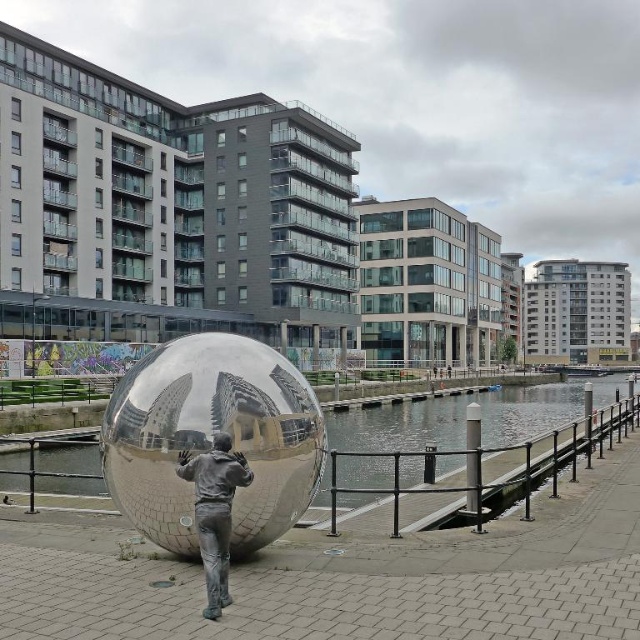
Question: Which point is closer to the camera?

Choices:
 (A) glossy metallic water at center
 (B) silver reflective statue at center

Answer: (B)

Question: Is glossy metallic water at center wider than silver reflective statue at center?

Choices:
 (A) no
 (B) yes

Answer: (B)

Question: Can you confirm if shiny metallic sphere at center is positioned to the right of silver reflective statue at center?

Choices:
 (A) no
 (B) yes

Answer: (A)

Question: Based on their relative distances, which object is nearer to the silver reflective statue at center?

Choices:
 (A) shiny metallic sphere at center
 (B) glossy metallic water at center

Answer: (A)

Question: Is shiny metallic sphere at center above glossy metallic water at center?

Choices:
 (A) no
 (B) yes

Answer: (B)

Question: Which point appears closest to the camera in this image?

Choices:
 (A) (332, 429)
 (B) (154, 515)
 (C) (220, 468)

Answer: (C)